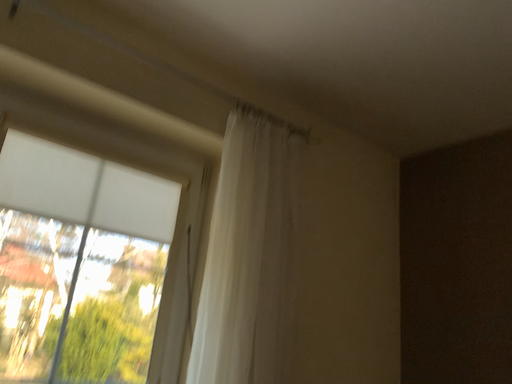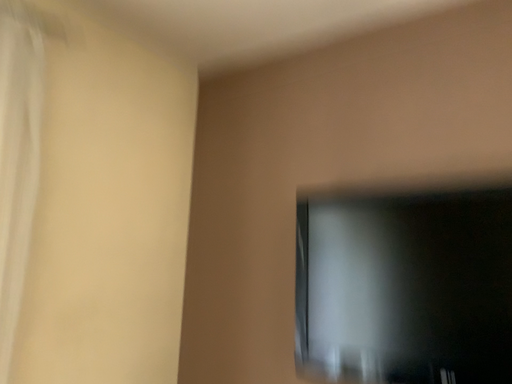
Question: How did the camera likely rotate when shooting the video?

Choices:
 (A) rotated right
 (B) rotated left

Answer: (A)